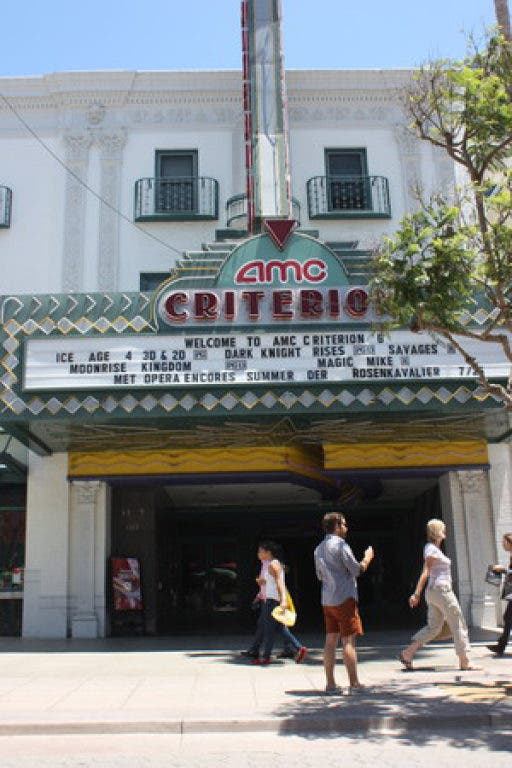
Where is `windows`? The height and width of the screenshot is (768, 512). windows is located at coordinates (166, 163), (339, 161).